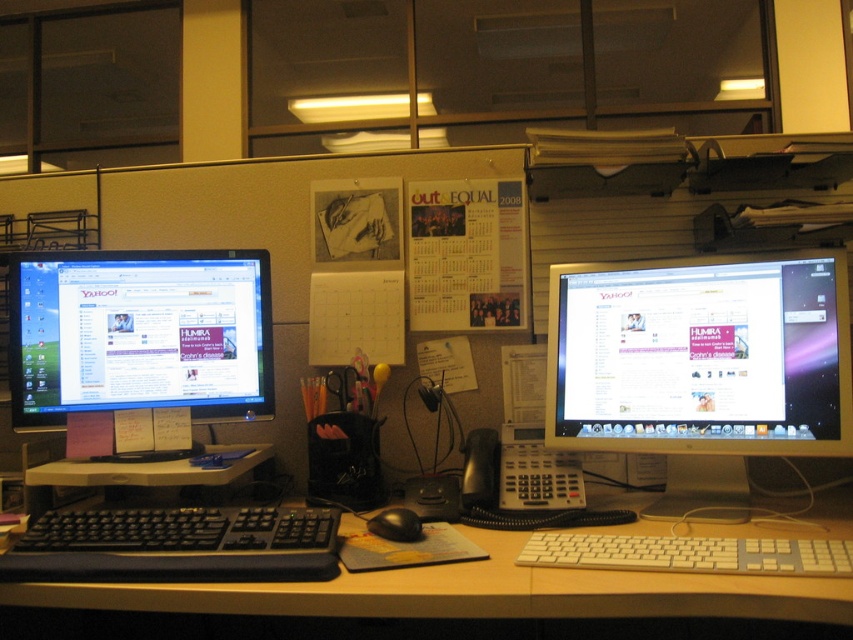
Question: Does matte black monitor at left appear over black plastic mouse at center?

Choices:
 (A) no
 (B) yes

Answer: (B)

Question: Which object is the farthest from the matte black monitor at left?

Choices:
 (A) black plastic keyboard at center
 (B) satin black monitor at center

Answer: (B)

Question: Is white plastic keyboard at lower center thinner than black plastic mouse at center?

Choices:
 (A) no
 (B) yes

Answer: (A)

Question: Is white plastic keyboard at lower center positioned before black plastic mouse at center?

Choices:
 (A) no
 (B) yes

Answer: (B)

Question: Which object is farther from the camera taking this photo?

Choices:
 (A) matte black monitor at left
 (B) black plastic mouse at center

Answer: (A)

Question: Which object is the closest to the black plastic keyboard at center?

Choices:
 (A) black plastic mouse at center
 (B) white plastic keyboard at lower center

Answer: (B)